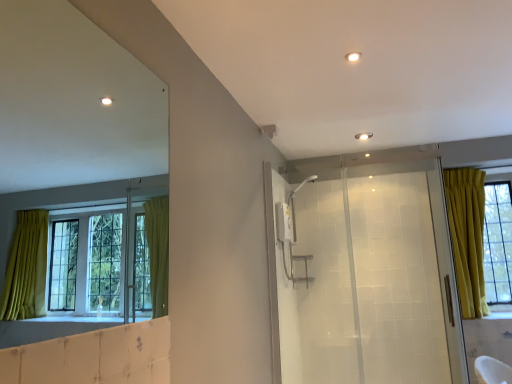
You are a GUI agent. You are given a task and a screenshot of the screen. Output one action in this format:
    pyautogui.click(x=<x>, y=<y>)
    Task: Click on the transparent glass shower door at center
    
    Given the screenshot: What is the action you would take?
    pyautogui.click(x=364, y=272)

Measure the distance between transparent glass shower door at center and camera.

8.77 feet.

Describe the element at coordinates (364, 272) in the screenshot. The height and width of the screenshot is (384, 512). I see `transparent glass shower door at center` at that location.

Describe the element at coordinates (353, 56) in the screenshot. This screenshot has height=384, width=512. I see `white glossy light at upper center` at that location.

Identify the location of white glossy light at upper center. (353, 56).

You are a GUI agent. You are given a task and a screenshot of the screen. Output one action in this format:
    pyautogui.click(x=<x>, y=<y>)
    Task: Click on the transparent glass shower door at center
    
    Given the screenshot: What is the action you would take?
    pyautogui.click(x=364, y=272)

Based on their positions, is transparent glass shower door at center located to the left or right of white glossy light at upper center?

Clearly, transparent glass shower door at center is on the right of white glossy light at upper center in the image.

Considering the positions of objects transparent glass shower door at center and white glossy light at upper center in the image provided, who is behind, transparent glass shower door at center or white glossy light at upper center?

Positioned behind is transparent glass shower door at center.

Between point (360, 366) and point (346, 57), which one is positioned in front?

The point (346, 57) is more forward.

From the image's perspective, who appears lower, transparent glass shower door at center or white glossy light at upper center?

transparent glass shower door at center.

From a real-world perspective, is transparent glass shower door at center on top of white glossy light at upper center?

No, from a real-world perspective, transparent glass shower door at center is not on top of white glossy light at upper center.

Does transparent glass shower door at center have a greater width compared to white glossy light at upper center?

Incorrect, the width of transparent glass shower door at center does not surpass that of white glossy light at upper center.

Does transparent glass shower door at center have a greater height compared to white glossy light at upper center?

Yes, transparent glass shower door at center is taller than white glossy light at upper center.

Can you confirm if transparent glass shower door at center is bigger than white glossy light at upper center?

Correct, transparent glass shower door at center is larger in size than white glossy light at upper center.

Is transparent glass shower door at center positioned beyond the bounds of white glossy light at upper center?

Yes, transparent glass shower door at center is not within white glossy light at upper center.

Would you consider transparent glass shower door at center to be distant from white glossy light at upper center?

Yes, transparent glass shower door at center is far from white glossy light at upper center.

Is transparent glass shower door at center looking in the opposite direction of white glossy light at upper center?

No, transparent glass shower door at center is not facing the opposite direction of white glossy light at upper center.

What's the angular difference between transparent glass shower door at center and white glossy light at upper center's facing directions?

The angle between the facing direction of transparent glass shower door at center and the facing direction of white glossy light at upper center is 169 degrees.

How distant is transparent glass shower door at center from white glossy light at upper center?

A distance of 1.91 meters exists between transparent glass shower door at center and white glossy light at upper center.

In order to click on light that is on the left side of transparent glass shower door at center in this screenshot , I will do `click(353, 56)`.

Which is more to the left, white glossy light at upper center or transparent glass shower door at center?

From the viewer's perspective, white glossy light at upper center appears more on the left side.

Is the position of white glossy light at upper center more distant than that of transparent glass shower door at center?

That is False.

Between point (353, 54) and point (270, 245), which one is positioned in front?

The point (353, 54) is in front.

From the image's perspective, does white glossy light at upper center appear higher than transparent glass shower door at center?

Yes, from the image's perspective, white glossy light at upper center is on top of transparent glass shower door at center.

From a real-world perspective, who is located higher, white glossy light at upper center or transparent glass shower door at center?

white glossy light at upper center is physically above.

Is white glossy light at upper center wider than transparent glass shower door at center?

Yes, white glossy light at upper center is wider than transparent glass shower door at center.

Does white glossy light at upper center have a greater height compared to transparent glass shower door at center?

In fact, white glossy light at upper center may be shorter than transparent glass shower door at center.

Considering the sizes of objects white glossy light at upper center and transparent glass shower door at center in the image provided, who is smaller, white glossy light at upper center or transparent glass shower door at center?

white glossy light at upper center is smaller.

Is white glossy light at upper center positioned beyond the bounds of transparent glass shower door at center?

That's correct, white glossy light at upper center is outside of transparent glass shower door at center.

Can you see white glossy light at upper center touching transparent glass shower door at center?

No, white glossy light at upper center is not making contact with transparent glass shower door at center.

Is transparent glass shower door at center at the back of white glossy light at upper center?

No.

Based on the photo, how many degrees apart are the facing directions of white glossy light at upper center and transparent glass shower door at center?

169 degrees.

In the image, there is a white glossy light at upper center. At what (x,y) coordinates should I click in order to perform the action: click on screen door below it (from a real-world perspective). Please return your answer as a coordinate pair (x, y). Image resolution: width=512 pixels, height=384 pixels. Looking at the image, I should click on (364, 272).

This screenshot has height=384, width=512. I want to click on screen door on the right of white glossy light at upper center, so [364, 272].

Locate an element on the screen. light on the left of transparent glass shower door at center is located at coordinates (353, 56).